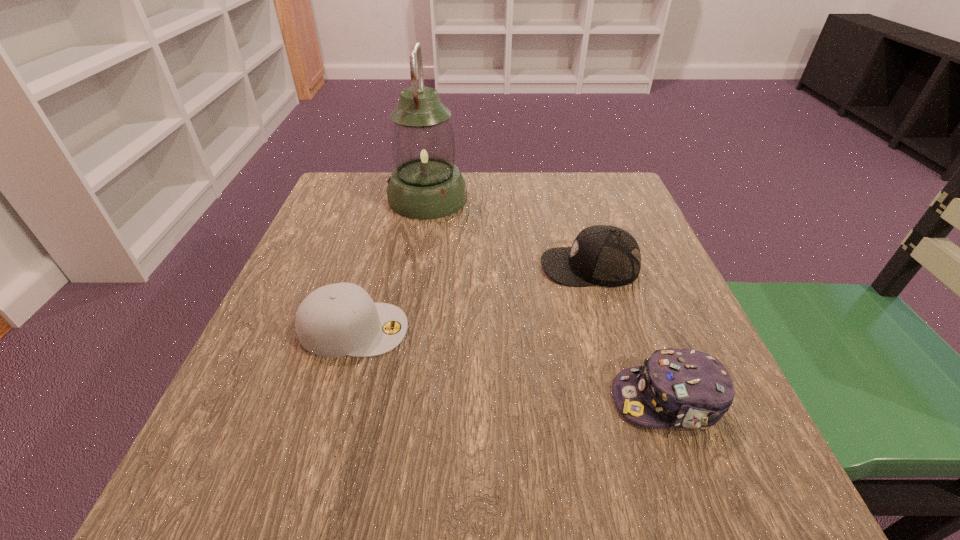
Where is `free space between the farthest object and the leftmost headwear`? free space between the farthest object and the leftmost headwear is located at coordinates pyautogui.click(x=391, y=264).

You are a GUI agent. You are given a task and a screenshot of the screen. Output one action in this format:
    pyautogui.click(x=<x>, y=<y>)
    Task: Click on the vacant area between the second nearest headwear and the nearest object
    
    Given the screenshot: What is the action you would take?
    pyautogui.click(x=511, y=364)

The height and width of the screenshot is (540, 960). I want to click on vacant area that lies between the farthest object and the leftmost headwear, so click(391, 264).

In order to click on empty space between the second farthest headwear and the lantern in this screenshot , I will do `click(391, 264)`.

Select which object is the closest to the farthest headwear. Please provide its 2D coordinates. Your answer should be formatted as a tuple, i.e. [(x, y)], where the tuple contains the x and y coordinates of a point satisfying the conditions above.

[(426, 184)]

Identify which object is the third nearest to the leftmost headwear. Please provide its 2D coordinates. Your answer should be formatted as a tuple, i.e. [(x, y)], where the tuple contains the x and y coordinates of a point satisfying the conditions above.

[(684, 388)]

Identify which headwear is the closest to the leftmost headwear. Please provide its 2D coordinates. Your answer should be formatted as a tuple, i.e. [(x, y)], where the tuple contains the x and y coordinates of a point satisfying the conditions above.

[(603, 255)]

Image resolution: width=960 pixels, height=540 pixels. In order to click on headwear that is the second closest to the farthest headwear in this screenshot , I will do `click(336, 320)`.